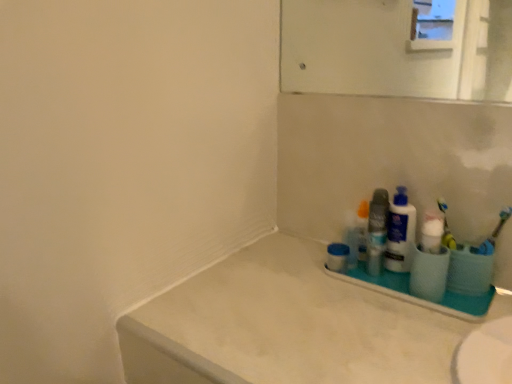
What are the coordinates of `free space behind blue matte jar at right` in the screenshot? It's located at (303, 243).